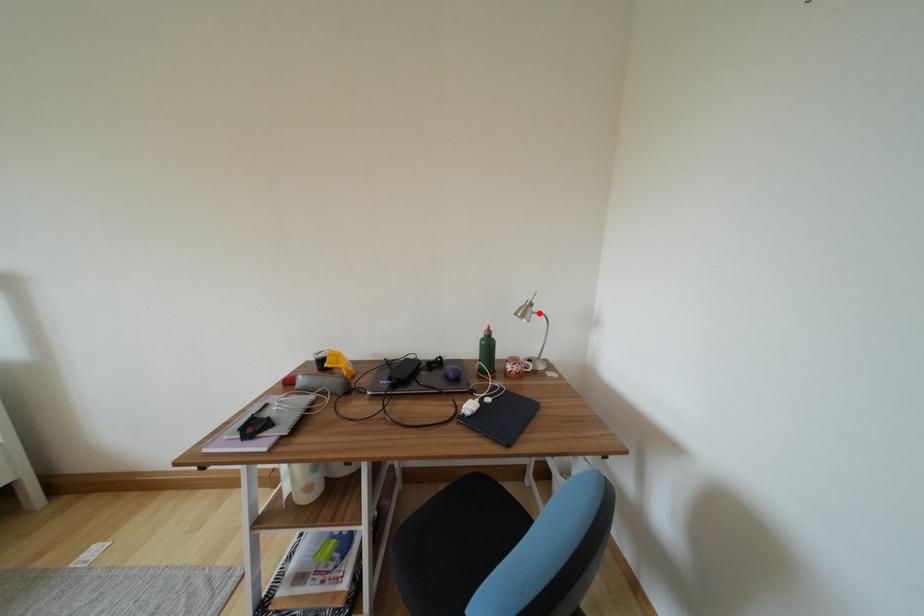
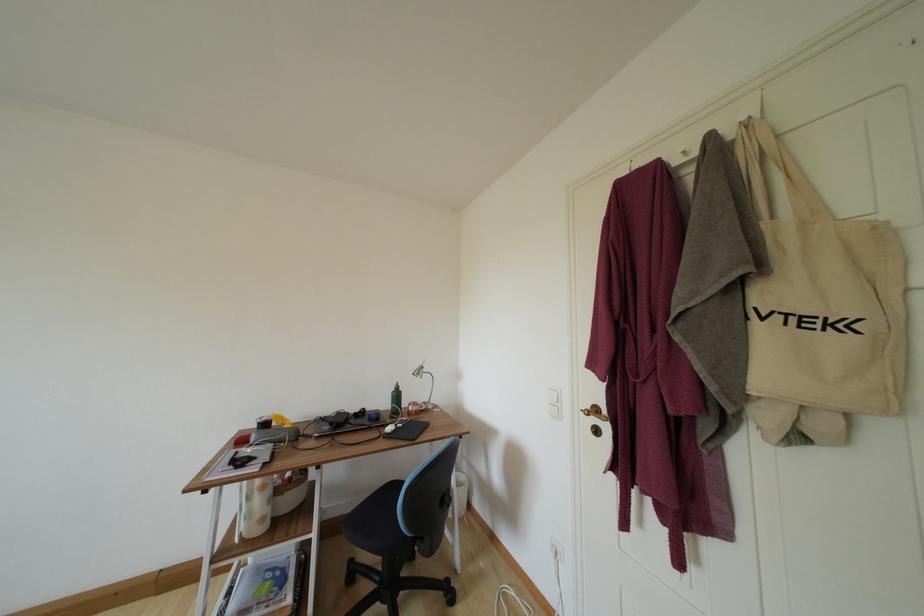
In the second image, find the point that corresponds to the highlighted location in the first image.

(430, 374)